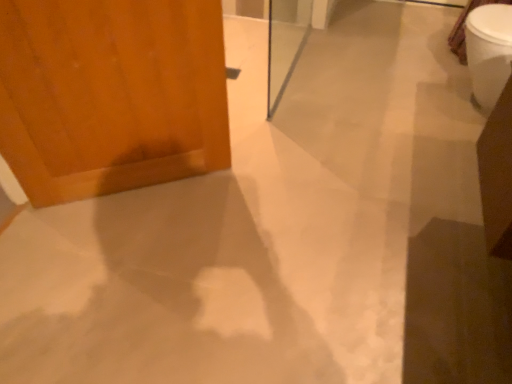
Question: Relative to wooden door at left, is white glossy toilet bowl at upper right in front or behind?

Choices:
 (A) behind
 (B) front

Answer: (A)

Question: Considering the positions of white glossy toilet bowl at upper right and wooden door at left in the image, is white glossy toilet bowl at upper right wider or thinner than wooden door at left?

Choices:
 (A) wide
 (B) thin

Answer: (A)

Question: Which object is the closest to the white glossy toilet bowl at upper right?

Choices:
 (A) transparent glass screen door at center
 (B) wooden door at left

Answer: (A)

Question: Which object is positioned farthest from the wooden door at left?

Choices:
 (A) transparent glass screen door at center
 (B) white glossy toilet bowl at upper right

Answer: (B)